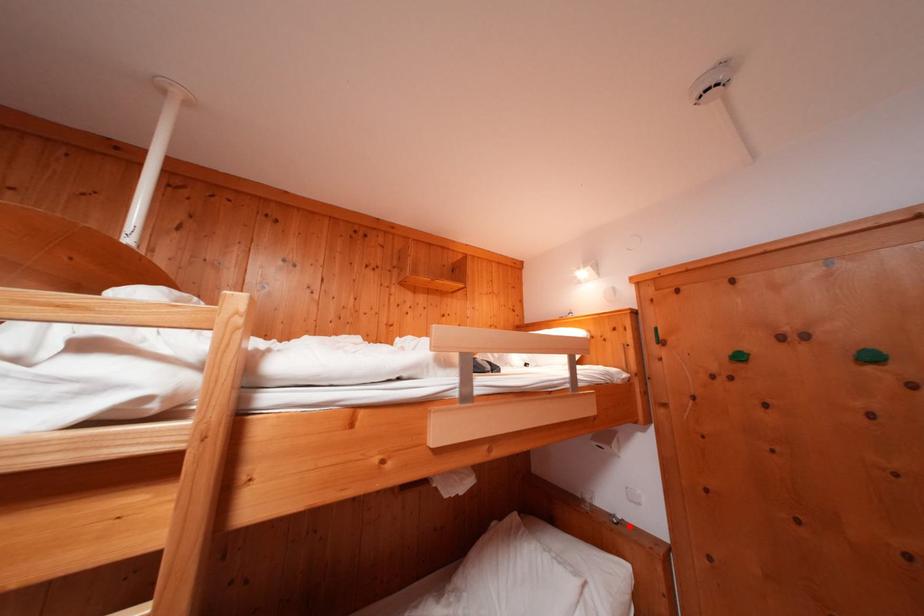
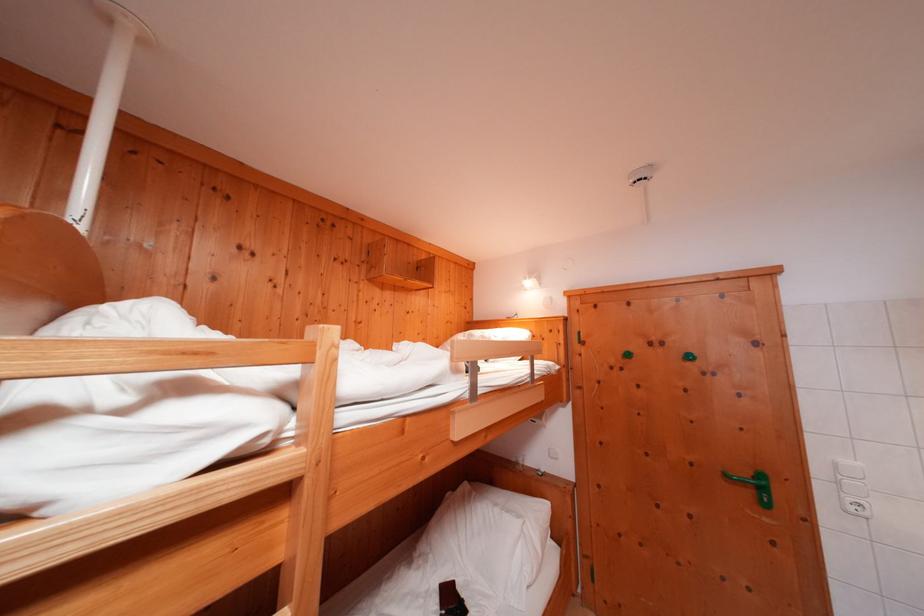
Locate, in the second image, the point that corresponds to the highlighted location in the first image.

(552, 477)